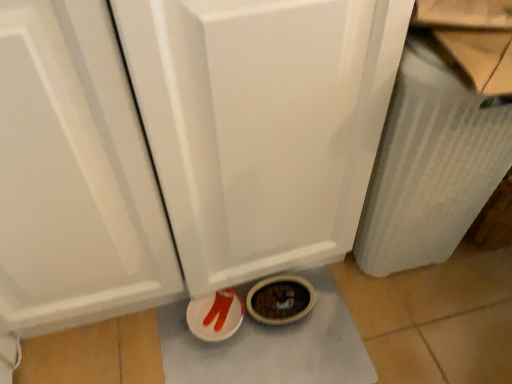
The image size is (512, 384). I want to click on free spot above white textured bath mat at lower center (from a real-world perspective), so click(270, 343).